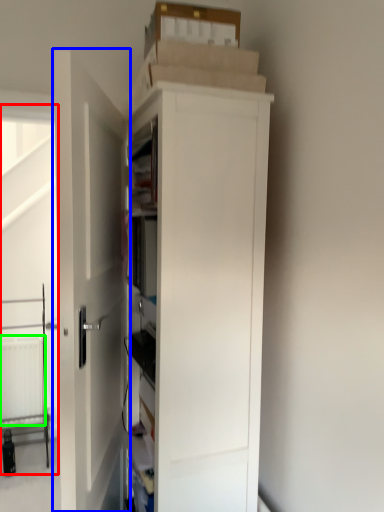
Question: Estimate the real-world distances between objects in this image. Which object is closer to screen door (highlighted by a red box), door (highlighted by a blue box) or radiator (highlighted by a green box)?

Choices:
 (A) door
 (B) radiator

Answer: (B)